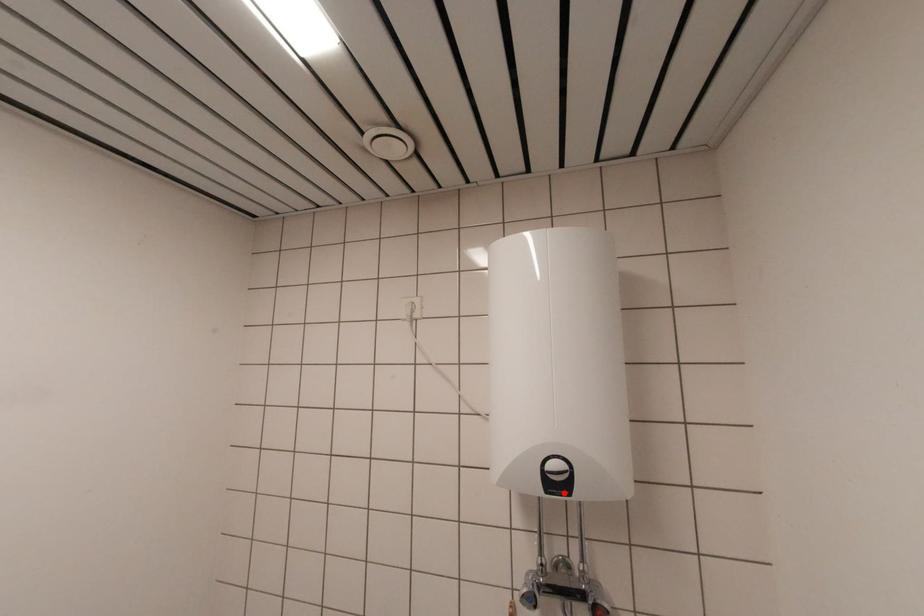
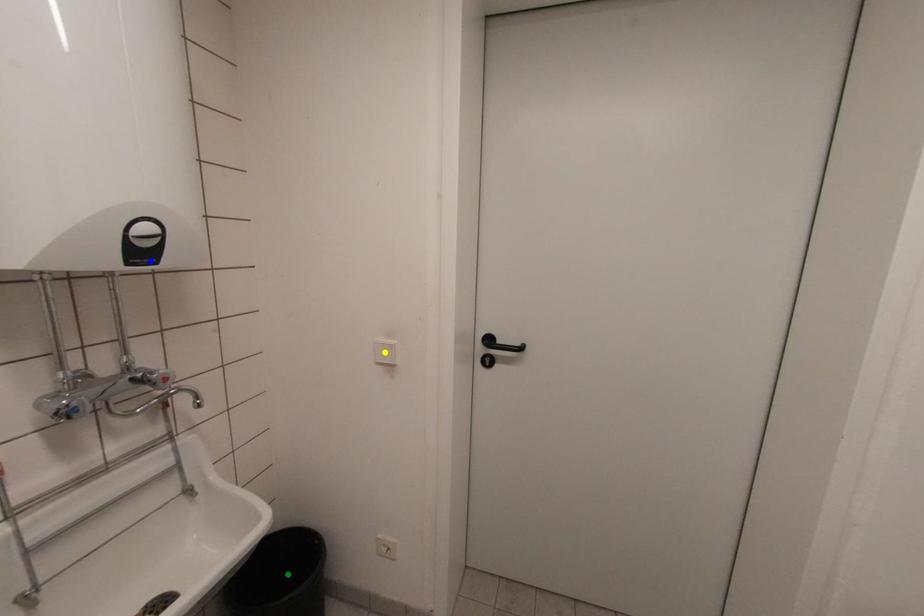
Question: I am providing you with two images of the same scene from different viewpoints. A red point is marked on the first image. You are given multiple points on the second image. In image 2, which mark is for the same physical point as the one in image 1?

Choices:
 (A) yellow point
 (B) green point
 (C) blue point

Answer: (C)